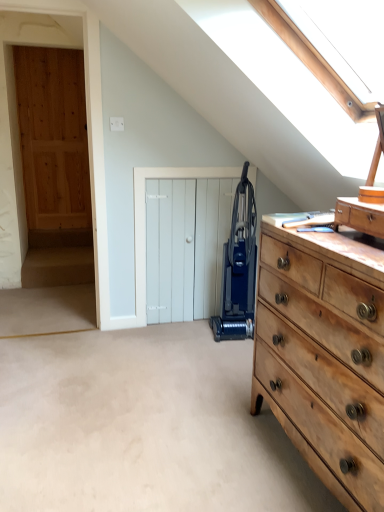
Question: Are natural wood dresser at right and blue plastic vacuum cleaner at center located far from each other?

Choices:
 (A) yes
 (B) no

Answer: (A)

Question: Can you confirm if natural wood dresser at right is thinner than blue plastic vacuum cleaner at center?

Choices:
 (A) no
 (B) yes

Answer: (A)

Question: Does natural wood dresser at right have a greater height compared to blue plastic vacuum cleaner at center?

Choices:
 (A) no
 (B) yes

Answer: (A)

Question: Is natural wood dresser at right further to camera compared to blue plastic vacuum cleaner at center?

Choices:
 (A) yes
 (B) no

Answer: (B)

Question: Would you say natural wood dresser at right contains blue plastic vacuum cleaner at center?

Choices:
 (A) no
 (B) yes

Answer: (A)

Question: From a real-world perspective, relative to white wooden door at center, is wooden drawer at right vertically above or below?

Choices:
 (A) above
 (B) below

Answer: (A)

Question: Is wooden drawer at right bigger or smaller than white wooden door at center?

Choices:
 (A) small
 (B) big

Answer: (A)

Question: From the image's perspective, is wooden drawer at right located above or below white wooden door at center?

Choices:
 (A) above
 (B) below

Answer: (A)

Question: In terms of width, does wooden drawer at right look wider or thinner when compared to white wooden door at center?

Choices:
 (A) thin
 (B) wide

Answer: (B)

Question: Looking at their shapes, would you say white wooden door at center is wider or thinner than wooden drawer at right?

Choices:
 (A) thin
 (B) wide

Answer: (A)

Question: Considering the positions of white wooden door at center and wooden drawer at right in the image, is white wooden door at center taller or shorter than wooden drawer at right?

Choices:
 (A) short
 (B) tall

Answer: (B)

Question: Is white wooden door at center bigger or smaller than wooden drawer at right?

Choices:
 (A) big
 (B) small

Answer: (A)

Question: Is white wooden door at center to the left or to the right of wooden drawer at right in the image?

Choices:
 (A) left
 (B) right

Answer: (A)

Question: From a real-world perspective, is blue plastic vacuum cleaner at center above or below natural wood dresser at right?

Choices:
 (A) above
 (B) below

Answer: (A)

Question: Considering the positions of blue plastic vacuum cleaner at center and natural wood dresser at right in the image, is blue plastic vacuum cleaner at center bigger or smaller than natural wood dresser at right?

Choices:
 (A) small
 (B) big

Answer: (A)